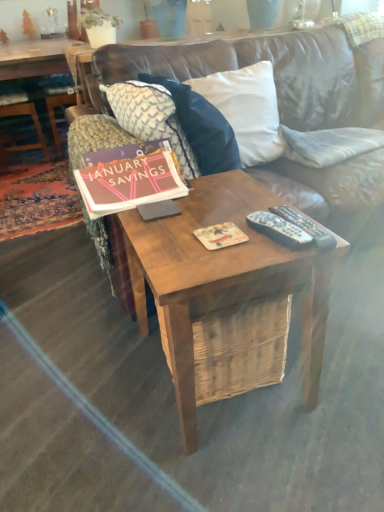
You are a GUI agent. You are given a task and a screenshot of the screen. Output one action in this format:
    pyautogui.click(x=<x>, y=<y>)
    Task: Click on the free space on the front side of black plastic remote controls at center, placed as the 1th remote control when sorted from left to right
    The height and width of the screenshot is (512, 384).
    Given the screenshot: What is the action you would take?
    pyautogui.click(x=272, y=254)